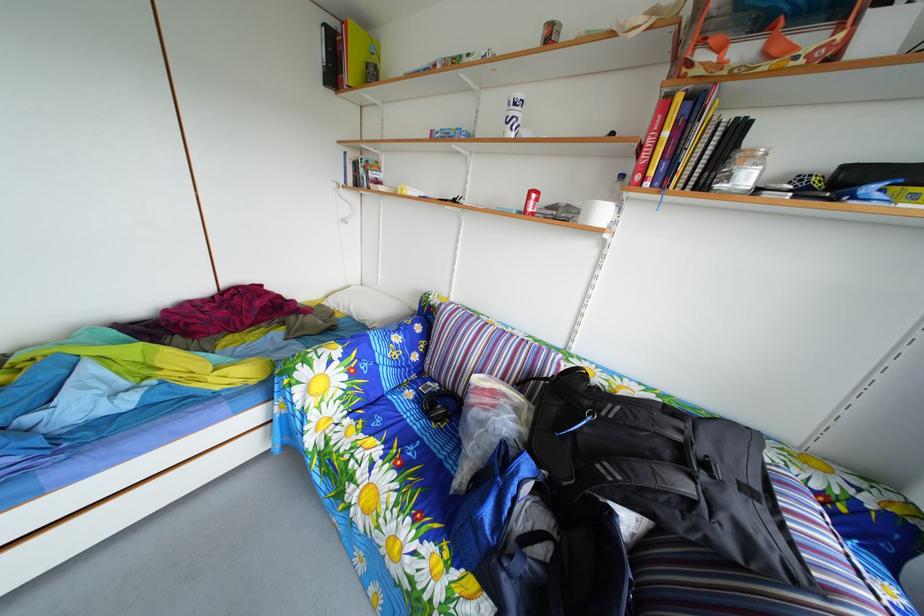
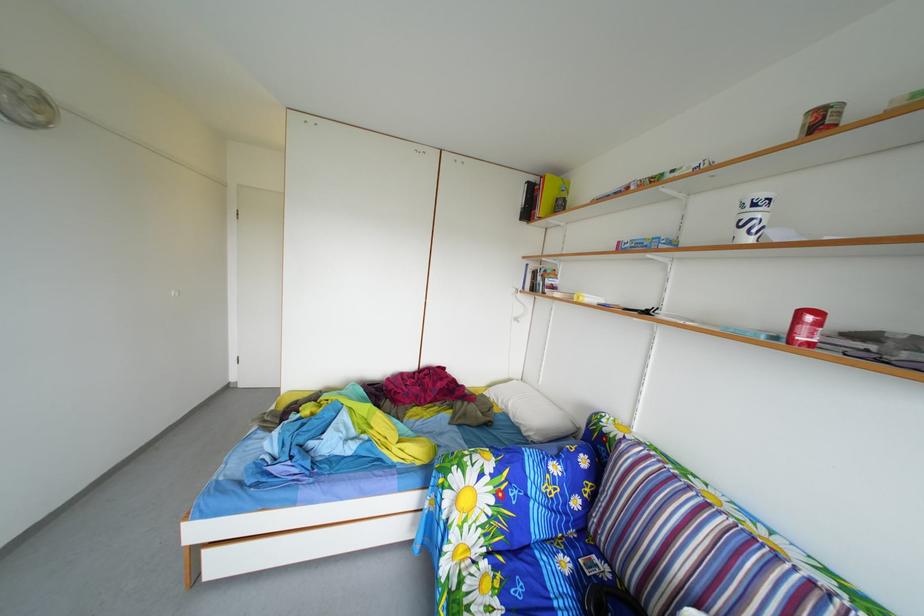
Find the pixel in the second image that matches the point at 329,60 in the first image.

(530, 208)